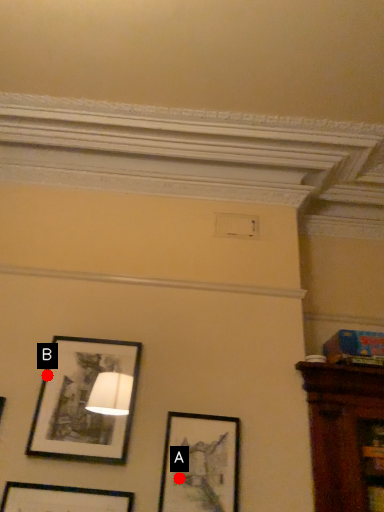
Question: Two points are circled on the image, labeled by A and B beside each circle. Which point appears closest to the camera in this image?

Choices:
 (A) A is closer
 (B) B is closer

Answer: (A)